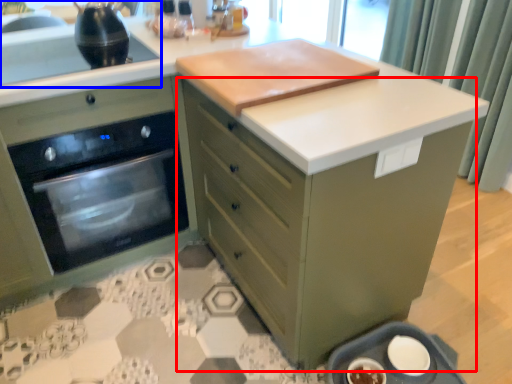
Question: Among these objects, which one is nearest to the camera, cabinetry (highlighted by a red box) or sink (highlighted by a blue box)?

Choices:
 (A) cabinetry
 (B) sink

Answer: (A)